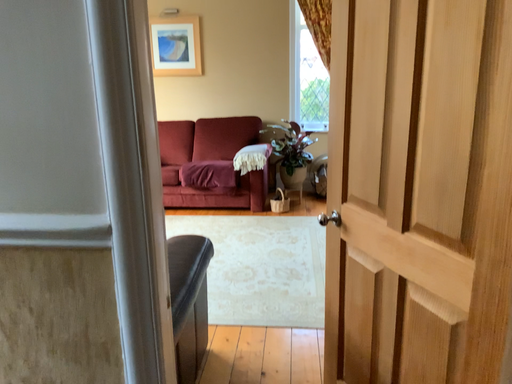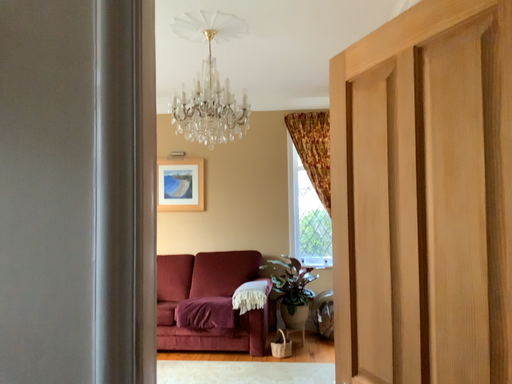
Question: Which way did the camera rotate in the video?

Choices:
 (A) rotated upward
 (B) rotated downward

Answer: (A)